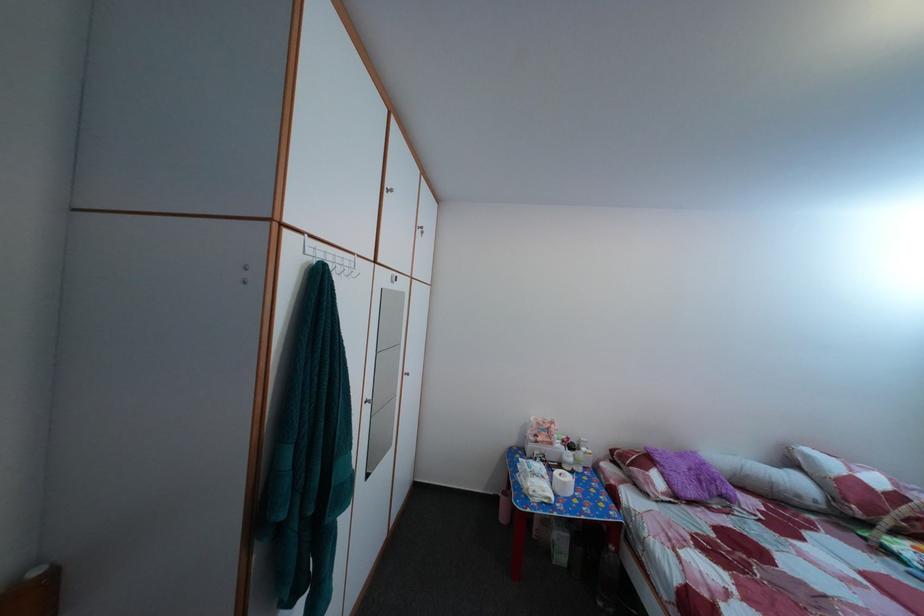
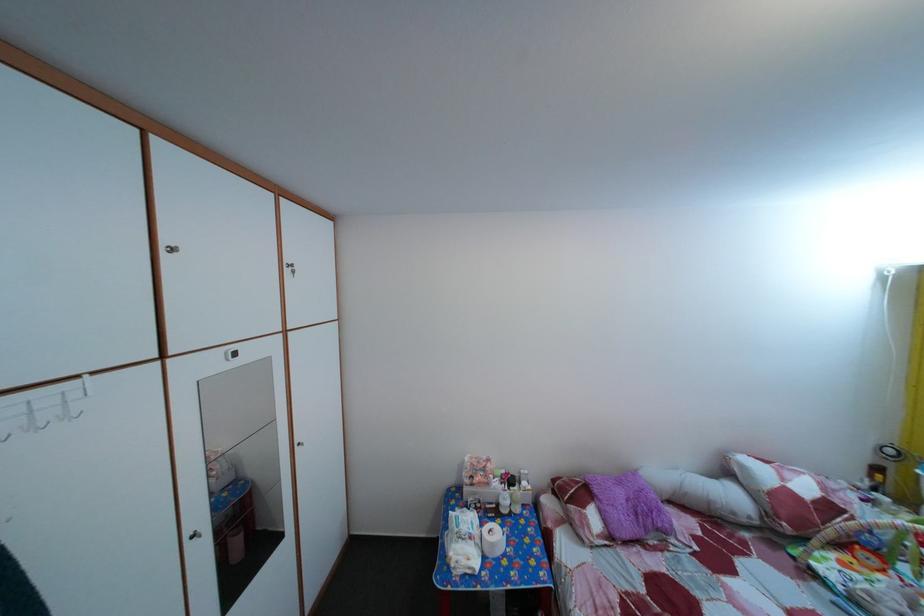
Locate, in the second image, the point that corresponds to point 582,451 in the first image.

(524, 485)